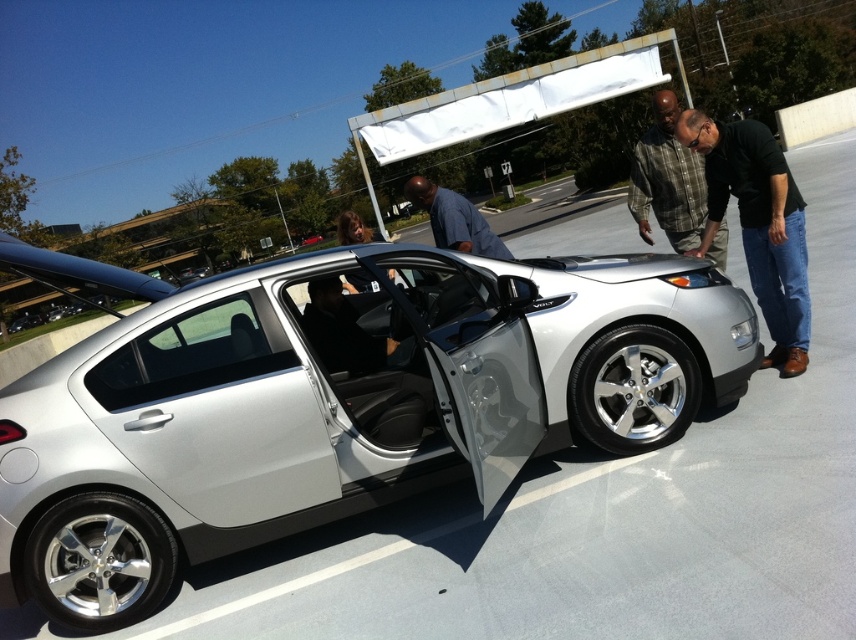
Which is in front, point (706, 362) or point (372, 289)?

Positioned in front is point (706, 362).

Can you confirm if silver metallic sedan at center is smaller than matte black car door at center?

Yes.

Find the location of a particular element. Image resolution: width=856 pixels, height=640 pixels. silver metallic sedan at center is located at coordinates (331, 400).

Which is in front, point (283, 362) or point (672, 92)?

Point (283, 362) is in front.

Identify the location of satin silver door at center. 215,410.

Find the location of a particular element. satin silver door at center is located at coordinates (215, 410).

Which is more to the left, plaid shirt at center or matte blue shirt at center?

matte blue shirt at center is more to the left.

Identify the location of plaid shirt at center. (667, 180).